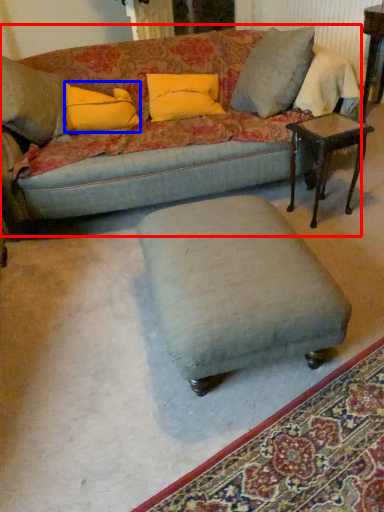
Question: Which object is closer to the camera taking this photo, studio couch (highlighted by a red box) or pillow (highlighted by a blue box)?

Choices:
 (A) studio couch
 (B) pillow

Answer: (A)